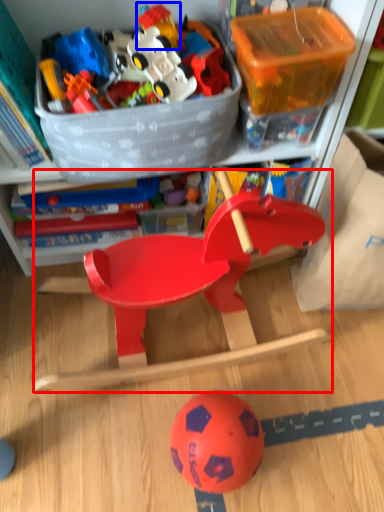
Question: Which point is further to the camera, toy (highlighted by a red box) or toy (highlighted by a blue box)?

Choices:
 (A) toy
 (B) toy

Answer: (B)